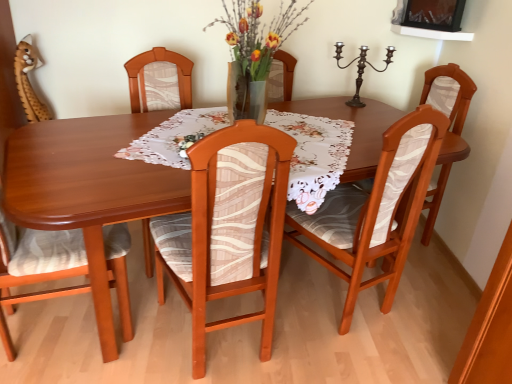
Question: Is wooden chair at center, marked as the fourth chair in a right-to-left arrangement, oriented towards floral lace tablecloth at center?

Choices:
 (A) no
 (B) yes

Answer: (B)

Question: Is wooden chair at center, marked as the fourth chair in a right-to-left arrangement, oriented away from floral lace tablecloth at center?

Choices:
 (A) yes
 (B) no

Answer: (B)

Question: Can floral lace tablecloth at center be found inside wooden chair at center, acting as the second chair starting from the left?

Choices:
 (A) yes
 (B) no

Answer: (B)

Question: Considering the relative sizes of wooden chair at center, marked as the fourth chair in a right-to-left arrangement, and floral lace tablecloth at center in the image provided, is wooden chair at center, marked as the fourth chair in a right-to-left arrangement, wider than floral lace tablecloth at center?

Choices:
 (A) no
 (B) yes

Answer: (A)

Question: From the image's perspective, is wooden chair at center, acting as the second chair starting from the left, below floral lace tablecloth at center?

Choices:
 (A) yes
 (B) no

Answer: (A)

Question: Considering the relative sizes of wooden chair at center, marked as the fourth chair in a right-to-left arrangement, and floral lace tablecloth at center in the image provided, is wooden chair at center, marked as the fourth chair in a right-to-left arrangement, smaller than floral lace tablecloth at center?

Choices:
 (A) no
 (B) yes

Answer: (A)

Question: Are bronze metallic candle holder at upper right and wooden chair with patterned fabric at center, which ranks as the 3th chair in right-to-left order, beside each other?

Choices:
 (A) yes
 (B) no

Answer: (B)

Question: Considering the relative sizes of bronze metallic candle holder at upper right and wooden chair with patterned fabric at center, placed as the third chair when sorted from left to right, in the image provided, is bronze metallic candle holder at upper right shorter than wooden chair with patterned fabric at center, placed as the third chair when sorted from left to right,?

Choices:
 (A) yes
 (B) no

Answer: (A)

Question: Is bronze metallic candle holder at upper right not within wooden chair with patterned fabric at center, which ranks as the 3th chair in right-to-left order?

Choices:
 (A) no
 (B) yes

Answer: (B)

Question: Is bronze metallic candle holder at upper right smaller than wooden chair with patterned fabric at center, placed as the third chair when sorted from left to right?

Choices:
 (A) yes
 (B) no

Answer: (A)

Question: Is bronze metallic candle holder at upper right looking in the opposite direction of wooden chair with patterned fabric at center, placed as the third chair when sorted from left to right?

Choices:
 (A) no
 (B) yes

Answer: (A)

Question: From a real-world perspective, does bronze metallic candle holder at upper right stand above wooden chair with patterned fabric at center, which ranks as the 3th chair in right-to-left order?

Choices:
 (A) yes
 (B) no

Answer: (A)

Question: Is wooden table at center far away from wooden chair with patterned fabric at center, placed as the third chair when sorted from left to right?

Choices:
 (A) no
 (B) yes

Answer: (A)